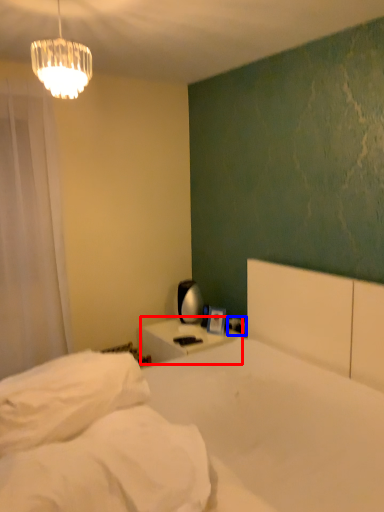
Question: Which point is closer to the camera, nightstand (highlighted by a red box) or electric outlet (highlighted by a blue box)?

Choices:
 (A) nightstand
 (B) electric outlet

Answer: (A)